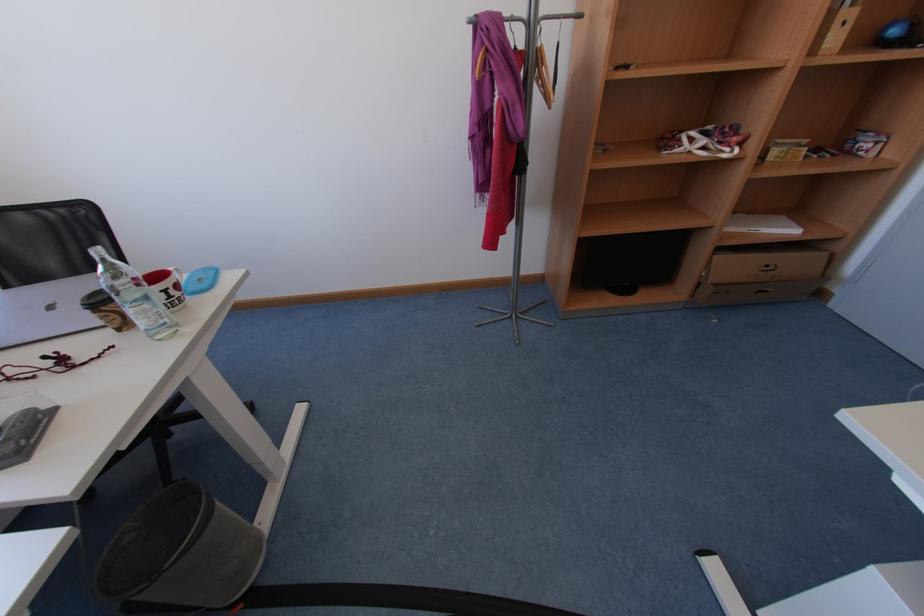
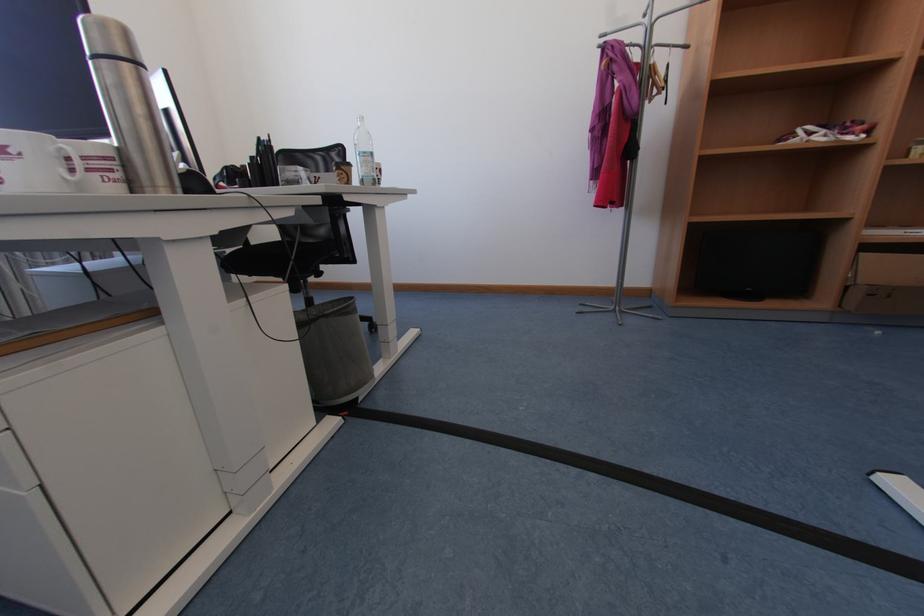
Based on the continuous images, in which direction is the camera rotating?

The camera rotated toward left-up.